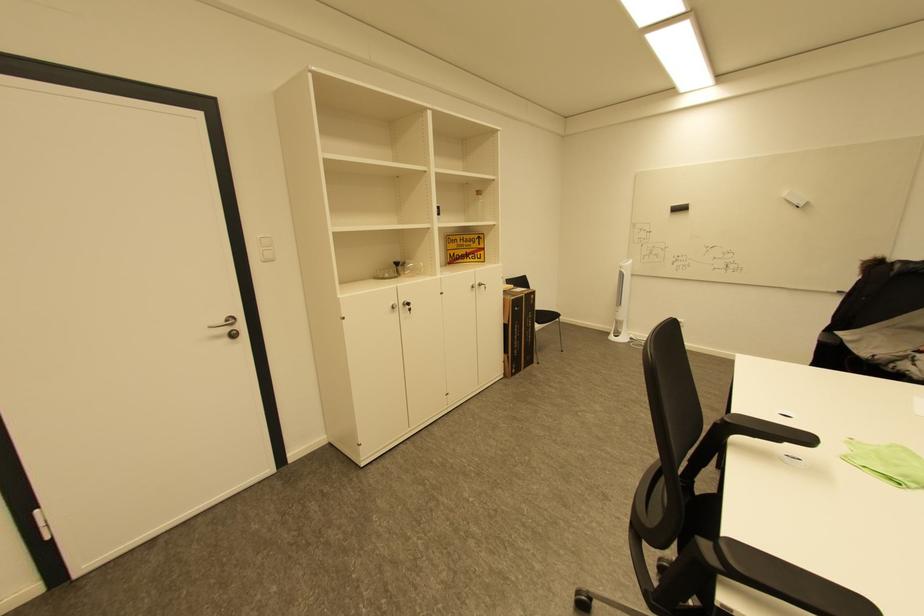
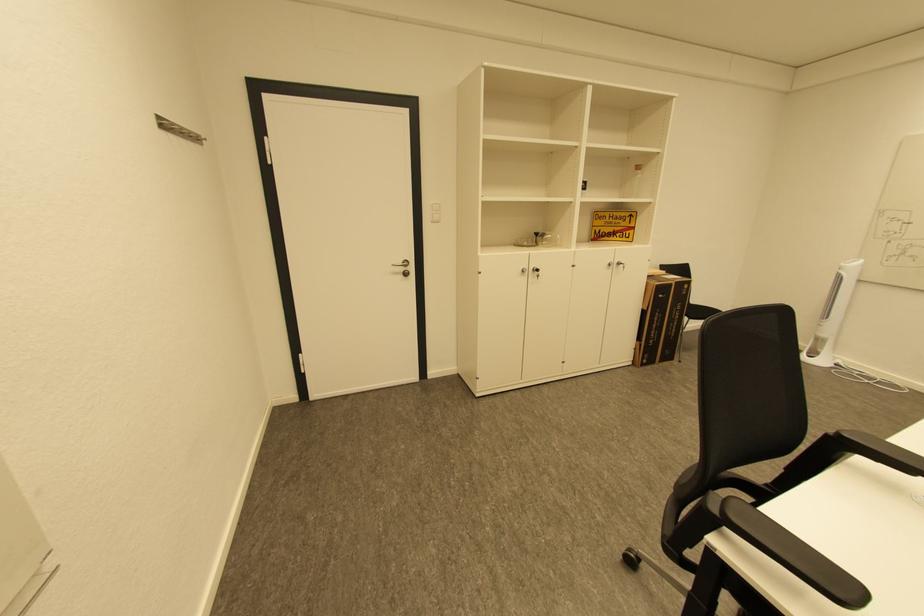
Find the pixel in the second image that matches pixel 398 308 in the first image.

(529, 272)